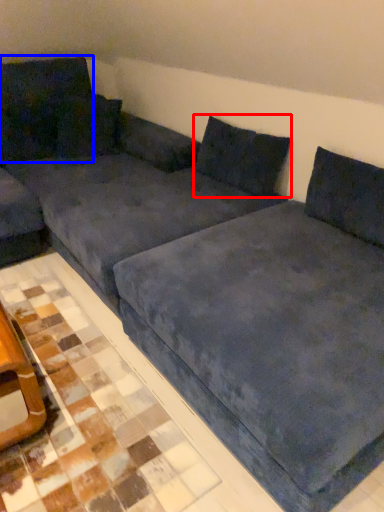
Question: Which of the following is the farthest to the observer, pillow (highlighted by a red box) or pillow (highlighted by a blue box)?

Choices:
 (A) pillow
 (B) pillow

Answer: (B)